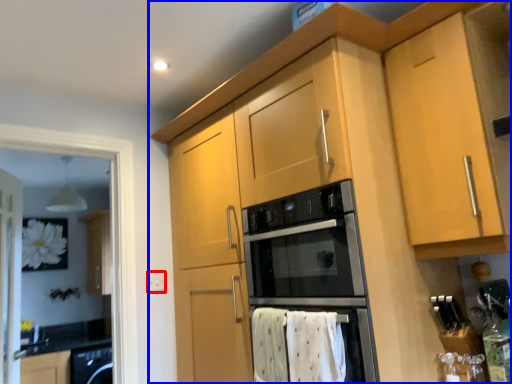
Question: Which of the following is the closest to the observer, electric outlet (highlighted by a red box) or cabinetry (highlighted by a blue box)?

Choices:
 (A) electric outlet
 (B) cabinetry

Answer: (B)